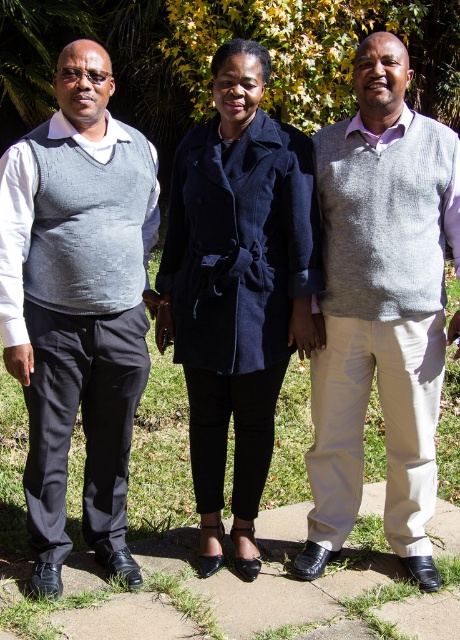
You are a photographer trying to capture a clear photo of the grey knitted vest at center and the velvet black coat at center. Since the two items are overlapping, which one should you focus on to ensure the other is visible in the background?

The grey knitted vest at center is in front of the velvet black coat at center, so focusing on the grey knitted vest at center will allow the velvet black coat at center to be visible in the background.

You are standing in a garden and see the matte gray sweater vest at left and the velvet black coat at center. Which clothing item is nearer to you?

The matte gray sweater vest at left is closer to the viewer than the velvet black coat at center.